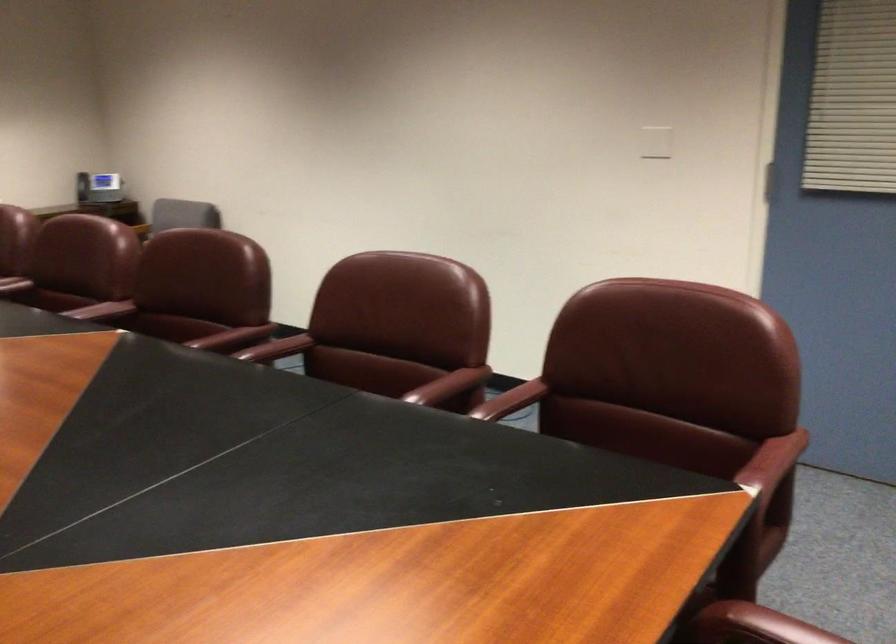
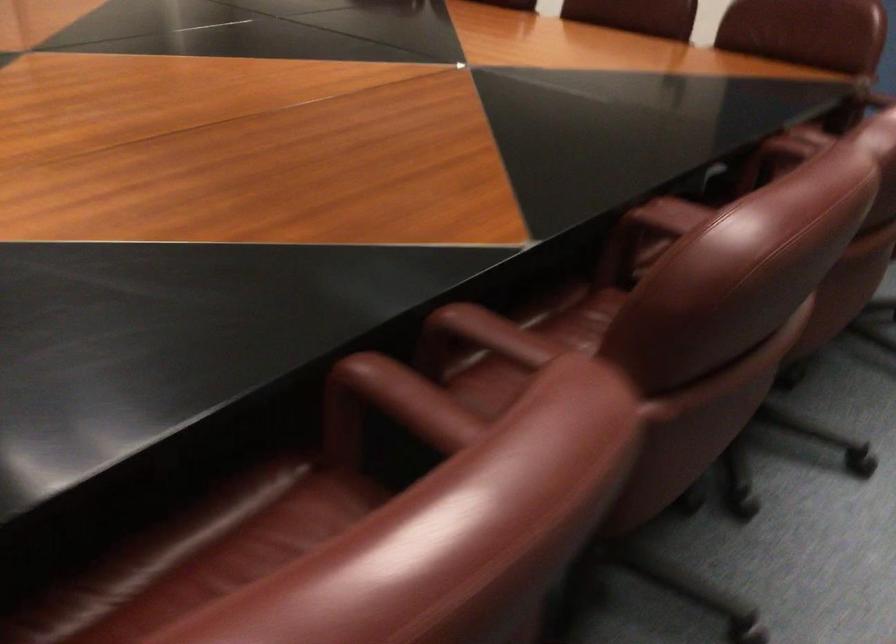
Where in the second image is the point corresponding to [271,346] from the first image?

(392, 404)